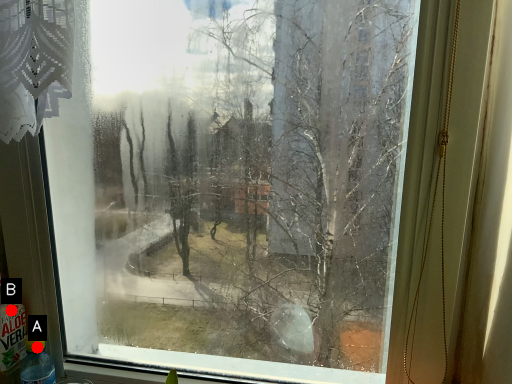
Question: Two points are circled on the image, labeled by A and B beside each circle. Which point is closer to the camera taking this photo?

Choices:
 (A) A is closer
 (B) B is closer

Answer: (A)